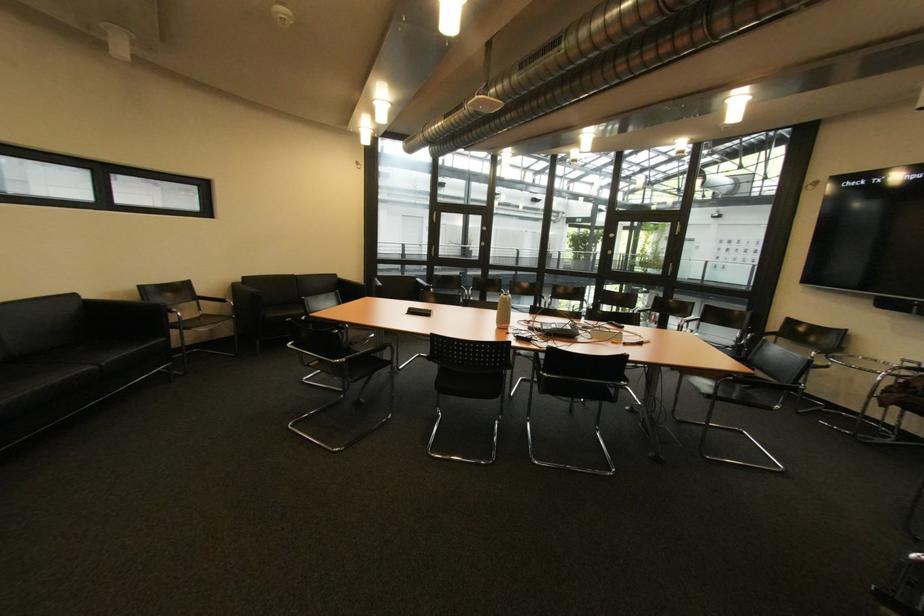
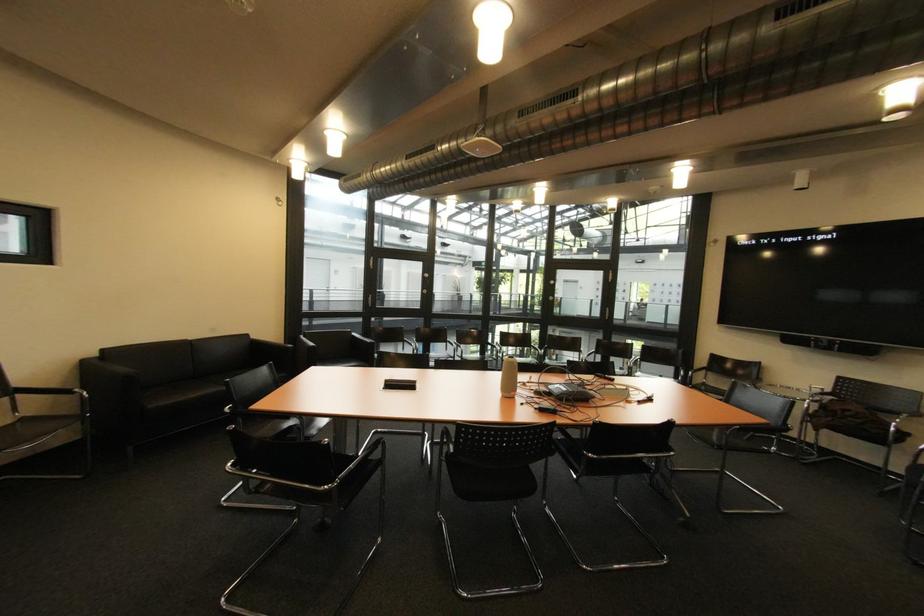
Question: The images are taken continuously from a first-person perspective. In which direction is your viewpoint rotating?

Choices:
 (A) Left
 (B) Right
 (C) Up
 (D) Down

Answer: (B)